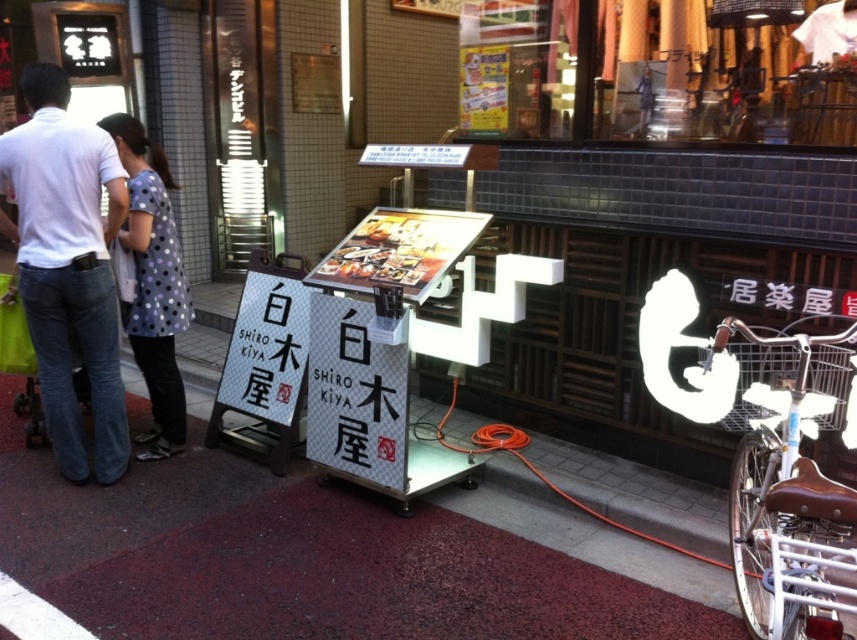
Which is in front, point (369, 349) or point (135, 248)?

Point (369, 349)

Is white paper sign at center further to camera compared to polka dot fabric dress at center?

No.

Locate an element on the screen. white paper sign at center is located at coordinates (355, 394).

What are the coordinates of `white paper sign at center` in the screenshot? It's located at (355, 394).

Is maroon carpet at center taller than white paper sign at center?

No, maroon carpet at center is not taller than white paper sign at center.

Is point (423, 512) closer to camera compared to point (375, 364)?

No.

This screenshot has height=640, width=857. I want to click on maroon carpet at center, so click(327, 561).

Find the location of a particular element. This screenshot has width=857, height=640. white cotton shirt at left is located at coordinates (69, 268).